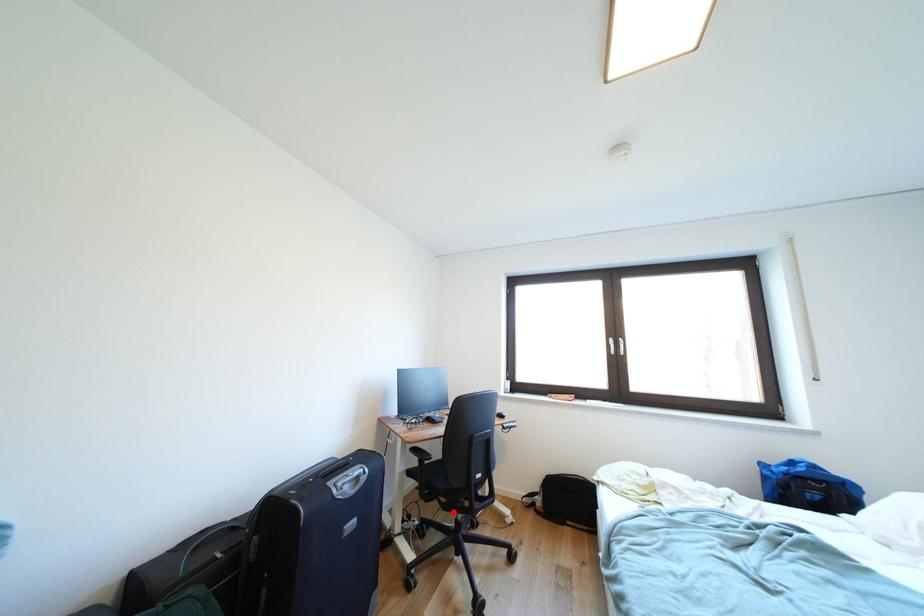
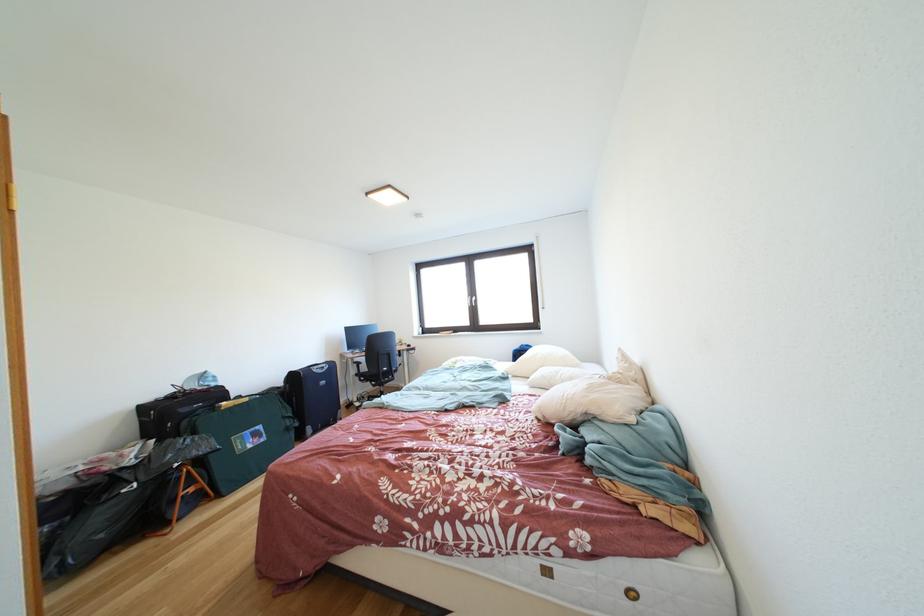
The point at the highlighted location is marked in the first image. Where is the corresponding point in the second image?

(383, 391)